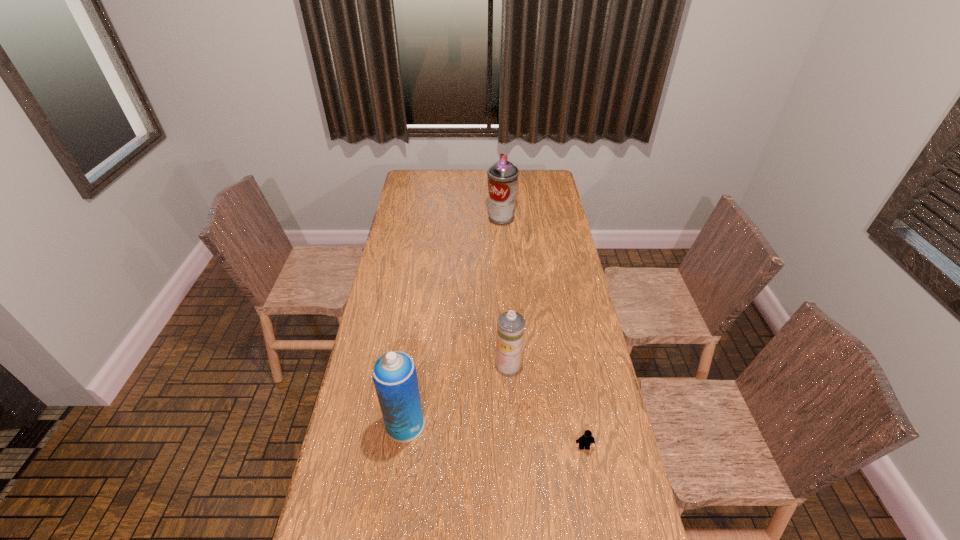
The image size is (960, 540). What are the coordinates of `the farthest aerosol can` in the screenshot? It's located at tap(502, 176).

I want to click on the leftmost object, so click(x=394, y=374).

Locate an element on the screen. The width and height of the screenshot is (960, 540). the second nearest object is located at coordinates (394, 374).

The height and width of the screenshot is (540, 960). In order to click on the second shortest object in this screenshot , I will do `click(510, 326)`.

Locate an element on the screen. This screenshot has width=960, height=540. the shortest aerosol can is located at coordinates (510, 326).

Identify the location of the shortest object. (586, 439).

Locate an element on the screen. Image resolution: width=960 pixels, height=540 pixels. the nearest object is located at coordinates (586, 439).

The width and height of the screenshot is (960, 540). What are the coordinates of `free spot located 0.300m on the front of the farthest aerosol can` in the screenshot? It's located at (504, 267).

Where is `free space located 0.210m on the back of the leftmost object`? This screenshot has height=540, width=960. free space located 0.210m on the back of the leftmost object is located at coordinates (415, 355).

I want to click on free space located 0.210m on the left of the shortest aerosol can, so click(436, 364).